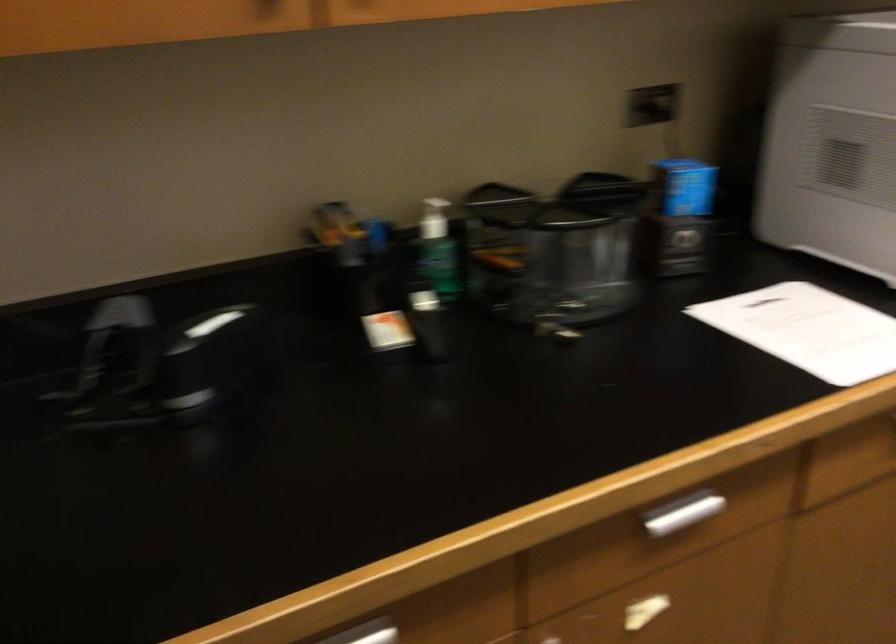
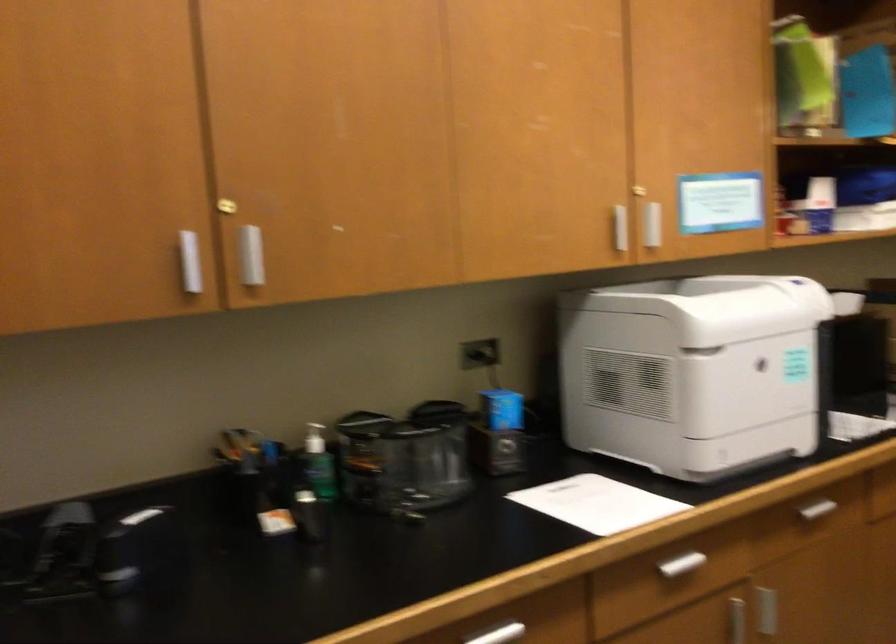
Question: The first image is from the beginning of the video and the second image is from the end. How did the camera likely rotate when shooting the video?

Choices:
 (A) Left
 (B) Right
 (C) Up
 (D) Down

Answer: (C)